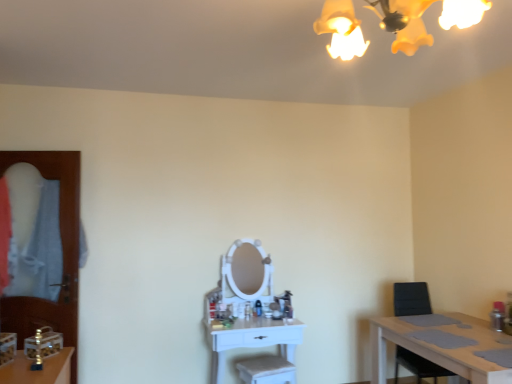
Question: Are transparent wooden door at left and light brown wooden table at lower right, the second table in the left-to-right sequence, located far from each other?

Choices:
 (A) yes
 (B) no

Answer: (A)

Question: Does transparent wooden door at left have a smaller size compared to light brown wooden table at lower right, the second table in the left-to-right sequence?

Choices:
 (A) no
 (B) yes

Answer: (B)

Question: Considering the relative sizes of transparent wooden door at left and light brown wooden table at lower right, acting as the 1th table starting from the right, in the image provided, is transparent wooden door at left thinner than light brown wooden table at lower right, acting as the 1th table starting from the right,?

Choices:
 (A) no
 (B) yes

Answer: (B)

Question: Can you confirm if transparent wooden door at left is bigger than light brown wooden table at lower right, acting as the 1th table starting from the right?

Choices:
 (A) yes
 (B) no

Answer: (B)

Question: From the image's perspective, is transparent wooden door at left below light brown wooden table at lower right, the second table in the left-to-right sequence?

Choices:
 (A) no
 (B) yes

Answer: (A)

Question: Considering the relative sizes of transparent wooden door at left and light brown wooden table at lower right, acting as the 1th table starting from the right, in the image provided, is transparent wooden door at left wider than light brown wooden table at lower right, acting as the 1th table starting from the right,?

Choices:
 (A) yes
 (B) no

Answer: (B)

Question: From the image's perspective, is black plastic chair at right over yellow matte light fixture at upper center?

Choices:
 (A) yes
 (B) no

Answer: (B)

Question: Considering the relative sizes of black plastic chair at right and yellow matte light fixture at upper center in the image provided, is black plastic chair at right thinner than yellow matte light fixture at upper center?

Choices:
 (A) no
 (B) yes

Answer: (A)

Question: Is black plastic chair at right placed right next to yellow matte light fixture at upper center?

Choices:
 (A) no
 (B) yes

Answer: (A)

Question: From a real-world perspective, is black plastic chair at right physically below yellow matte light fixture at upper center?

Choices:
 (A) no
 (B) yes

Answer: (B)

Question: Does black plastic chair at right appear on the left side of yellow matte light fixture at upper center?

Choices:
 (A) no
 (B) yes

Answer: (A)

Question: Is the depth of black plastic chair at right less than that of yellow matte light fixture at upper center?

Choices:
 (A) yes
 (B) no

Answer: (B)

Question: Is transparent wooden door at left surrounded by light brown wooden table at lower right, the second table in the left-to-right sequence?

Choices:
 (A) yes
 (B) no

Answer: (B)